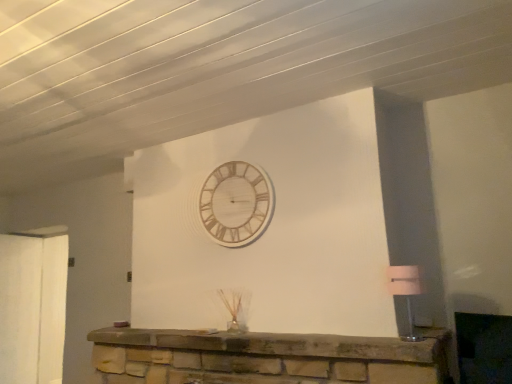
The height and width of the screenshot is (384, 512). I want to click on stone fireplace at center, so click(x=265, y=357).

From a real-world perspective, is stone fireplace at center physically located above or below wooden/textured wall clock at upper center?

stone fireplace at center is situated lower than wooden/textured wall clock at upper center in the real world.

Which object is more forward, stone fireplace at center or wooden/textured wall clock at upper center?

Positioned in front is stone fireplace at center.

Is stone fireplace at center directly adjacent to wooden/textured wall clock at upper center?

stone fireplace at center and wooden/textured wall clock at upper center are not in contact.

Considering the relative sizes of matte white lampshade at right and wooden/textured wall clock at upper center in the image provided, is matte white lampshade at right wider than wooden/textured wall clock at upper center?

Indeed, matte white lampshade at right has a greater width compared to wooden/textured wall clock at upper center.

Between matte white lampshade at right and wooden/textured wall clock at upper center, which one has larger size?

With larger size is wooden/textured wall clock at upper center.

Considering the positions of objects matte white lampshade at right and wooden/textured wall clock at upper center in the image provided, who is more to the left, matte white lampshade at right or wooden/textured wall clock at upper center?

wooden/textured wall clock at upper center.

Can you confirm if matte white lampshade at right is shorter than wooden/textured wall clock at upper center?

Yes.

Which of these two, matte white lampshade at right or stone fireplace at center, is thinner?

matte white lampshade at right.

Where is `furniture below the matte white lampshade at right (from the image's perspective)`? This screenshot has width=512, height=384. furniture below the matte white lampshade at right (from the image's perspective) is located at coordinates (265, 357).

Can stone fireplace at center be found inside matte white lampshade at right?

No, stone fireplace at center is located outside of matte white lampshade at right.

Can you tell me how much matte white lampshade at right and stone fireplace at center differ in facing direction?

There is a 0.202-degree angle between the facing directions of matte white lampshade at right and stone fireplace at center.

Is stone fireplace at center facing towards matte white lampshade at right?

No, stone fireplace at center is not aimed at matte white lampshade at right.

Is stone fireplace at center in front of or behind matte white lampshade at right in the image?

Clearly, stone fireplace at center is in front of matte white lampshade at right.

Who is bigger, stone fireplace at center or matte white lampshade at right?

stone fireplace at center is bigger.

Is stone fireplace at center far away from matte white lampshade at right?

No, there isn't a large distance between stone fireplace at center and matte white lampshade at right.

Is wooden/textured wall clock at upper center touching stone fireplace at center?

No, wooden/textured wall clock at upper center is not beside stone fireplace at center.

Is wooden/textured wall clock at upper center facing towards stone fireplace at center?

No.

Is wooden/textured wall clock at upper center completely or partially outside of stone fireplace at center?

Answer: wooden/textured wall clock at upper center is positioned outside stone fireplace at center.

Is wooden/textured wall clock at upper center oriented away from matte white lampshade at right?

No, wooden/textured wall clock at upper center is not facing the opposite direction of matte white lampshade at right.

Between point (259, 208) and point (400, 278), which one is positioned in front?

The point (400, 278) is closer to the camera.

Which object is positioned more to the right, wooden/textured wall clock at upper center or matte white lampshade at right?

matte white lampshade at right.

Are wooden/textured wall clock at upper center and matte white lampshade at right located far from each other?

Absolutely, wooden/textured wall clock at upper center is distant from matte white lampshade at right.

Locate an element on the screen. The height and width of the screenshot is (384, 512). wall clock to the left of stone fireplace at center is located at coordinates (236, 204).

What are the coordinates of `lamp located on the right of wooden/textured wall clock at upper center` in the screenshot? It's located at (406, 291).

Based on their spatial positions, is wooden/textured wall clock at upper center or stone fireplace at center closer to matte white lampshade at right?

stone fireplace at center is positioned closer to the anchor matte white lampshade at right.

Looking at this image, looking at the image, which one is located further to wooden/textured wall clock at upper center, matte white lampshade at right or stone fireplace at center?

Among the two, matte white lampshade at right is located further to wooden/textured wall clock at upper center.

From the image, which object appears to be farther from stone fireplace at center, wooden/textured wall clock at upper center or matte white lampshade at right?

Based on the image, matte white lampshade at right appears to be further to stone fireplace at center.

Estimate the real-world distances between objects in this image. Which object is further from stone fireplace at center, matte white lampshade at right or wooden/textured wall clock at upper center?

Among the two, matte white lampshade at right is located further to stone fireplace at center.

Based on their spatial positions, is stone fireplace at center or matte white lampshade at right closer to wooden/textured wall clock at upper center?

Based on the image, stone fireplace at center appears to be nearer to wooden/textured wall clock at upper center.

Looking at the image, which one is located closer to matte white lampshade at right, stone fireplace at center or wooden/textured wall clock at upper center?

stone fireplace at center is positioned closer to the anchor matte white lampshade at right.

Find the location of a particular element. furniture located between wooden/textured wall clock at upper center and matte white lampshade at right in the left-right direction is located at coordinates (265, 357).